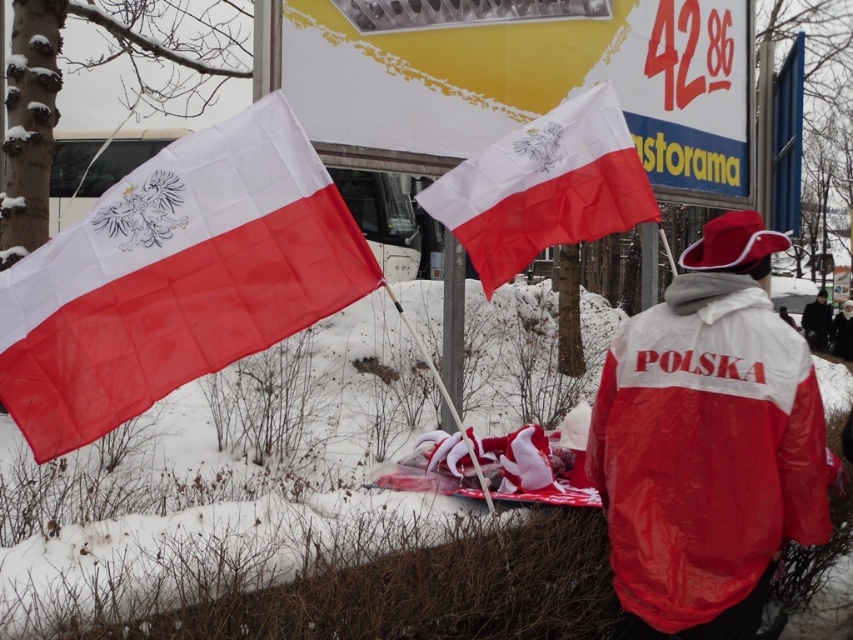
You are a photographer standing 2 meters away from the camera. You want to take a photo of the white fabric flag at left. Can you reach the camera in time to capture the flag before it moves out of frame?

The distance between you and the camera is 2 meters, and the camera is 2.94 meters away from the white fabric flag at left. Since you are already 2 meters away from the camera, you are within reach to capture the flag before it moves out of frame.

You are a photographer trying to capture a photo of the matte red jacket at center without the white fabric flag at left blocking it. Based on the scene description, can you position yourself in a way to avoid the flag obscuring the jacket?

The white fabric flag at left is above the matte red jacket at center, so if you position yourself below the flag or move to the side, you can avoid the flag blocking the jacket.

You are designing a display for a Polish cultural event. You have two items to place on a table in front of you. The items are the crinkled fabric flag at center and the black leather jacket at right. According to the scene, which item should you place closer to the edge of the table to ensure it doesn

The crinkled fabric flag at center has a smaller size compared to the black leather jacket at right, so placing the flag closer to the edge would prevent it from being overshadowed by the larger jacket.